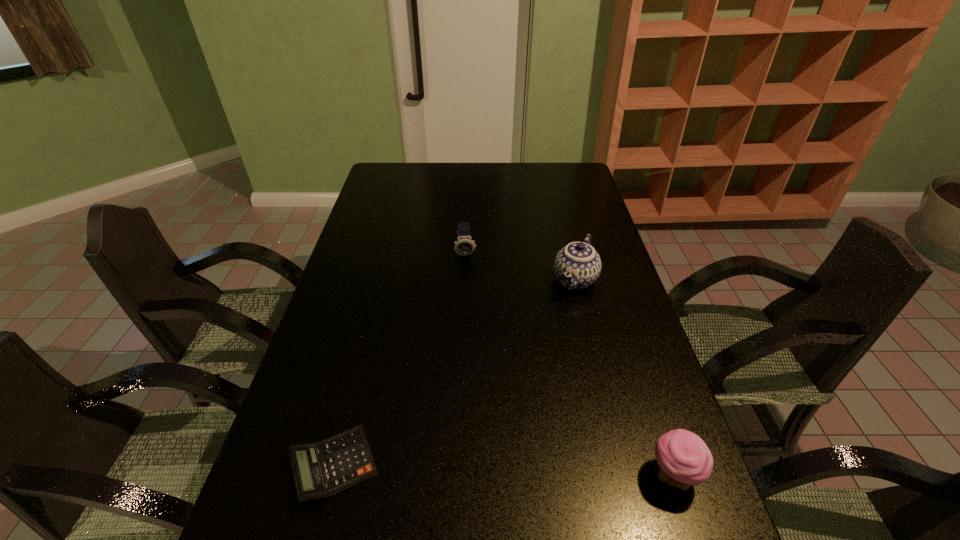
Image resolution: width=960 pixels, height=540 pixels. In the image, there is a desktop. Identify the location of vacant space at the far edge. (470, 176).

This screenshot has width=960, height=540. Find the location of `free space at the near edge`. free space at the near edge is located at coordinates (514, 510).

Find the location of `free space at the left edge of the desktop`. free space at the left edge of the desktop is located at coordinates (356, 355).

You are a GUI agent. You are given a task and a screenshot of the screen. Output one action in this format:
    pyautogui.click(x=<x>, y=<y>)
    Task: Click on the free space at the right edge of the desktop
    
    Given the screenshot: What is the action you would take?
    pyautogui.click(x=610, y=251)

Where is `vacant space at the far right corner of the desktop`? vacant space at the far right corner of the desktop is located at coordinates (553, 180).

Find the location of a particular element. The image size is (960, 540). empty location between the cupcake and the second object from left to right is located at coordinates (569, 364).

This screenshot has height=540, width=960. In order to click on free space between the second object from left to right and the chinaware in this screenshot , I will do `click(520, 267)`.

Locate an element on the screen. Image resolution: width=960 pixels, height=540 pixels. vacant region between the second object from left to right and the chinaware is located at coordinates (520, 267).

You are a GUI agent. You are given a task and a screenshot of the screen. Output one action in this format:
    pyautogui.click(x=<x>, y=<y>)
    Task: Click on the vacant region between the tallest object and the shortest object
    The image size is (960, 540).
    Given the screenshot: What is the action you would take?
    pyautogui.click(x=454, y=373)

This screenshot has height=540, width=960. I want to click on vacant space that's between the tallest object and the cupcake, so click(624, 377).